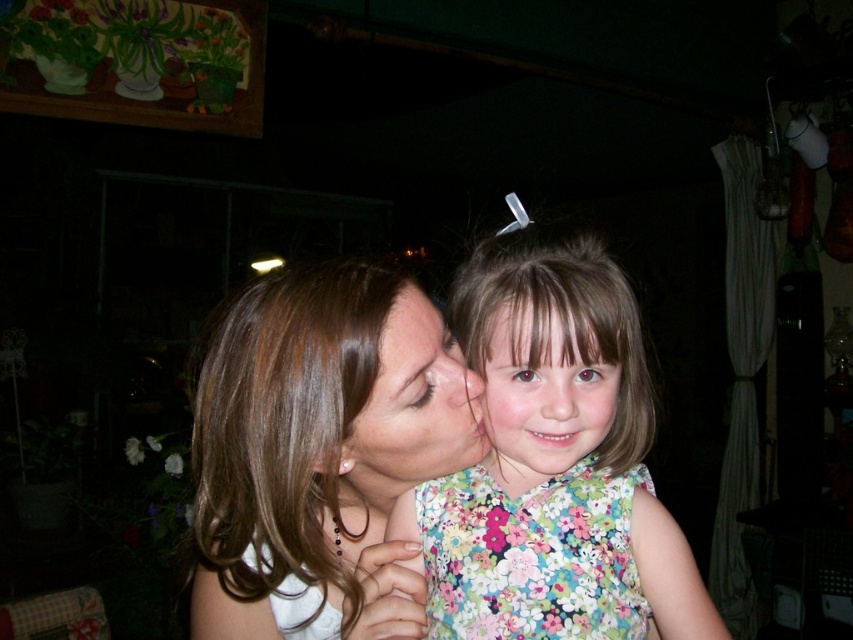
You are a photographer trying to capture the perfect shot of the two people in the scene. You notice the floral fabric face at center and the smooth skin forehead at center. Which object should you focus on if you want to capture the most detailed image, considering their sizes?

The floral fabric face at center has a larger size compared to the smooth skin forehead at center, so focusing on the floral fabric face at center would allow you to capture more detailed features due to its larger size.

Looking at the scene, there are two faces at the center of the image. The first is a smooth skin face at center, and the second is a floral fabric face at center. Which one is positioned to the left?

The smooth skin face at center is to the left of the floral fabric face at center.